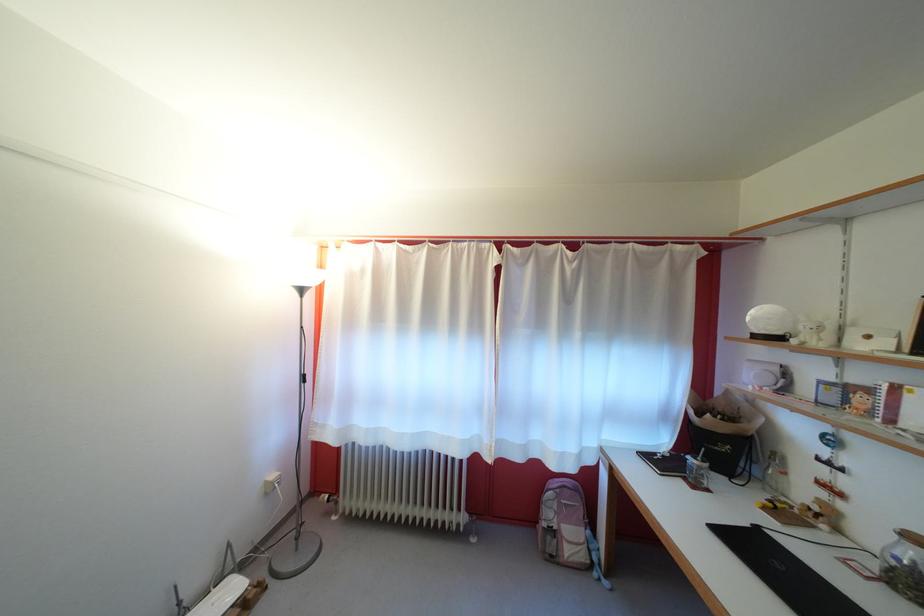
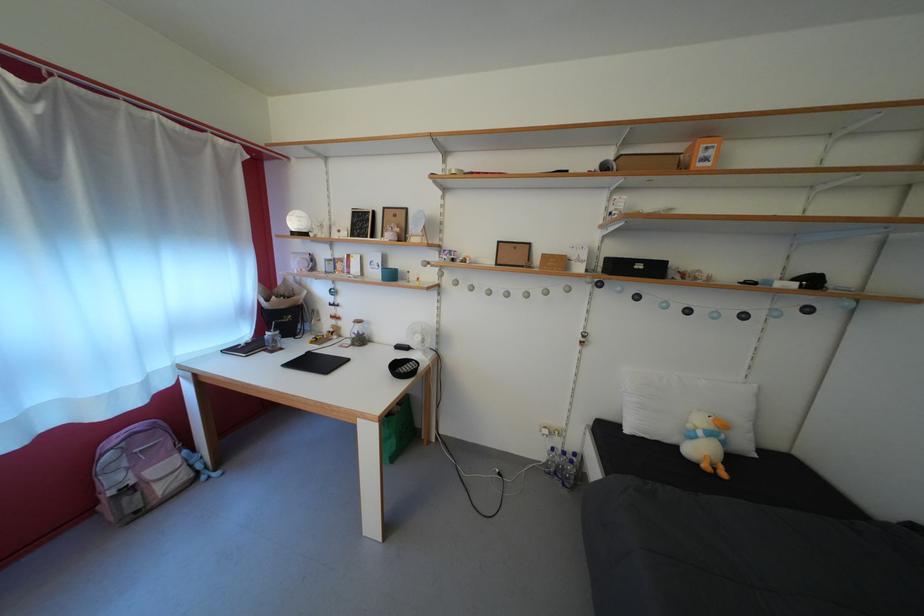
The point at (882, 541) is marked in the first image. Where is the corresponding point in the second image?

(358, 334)